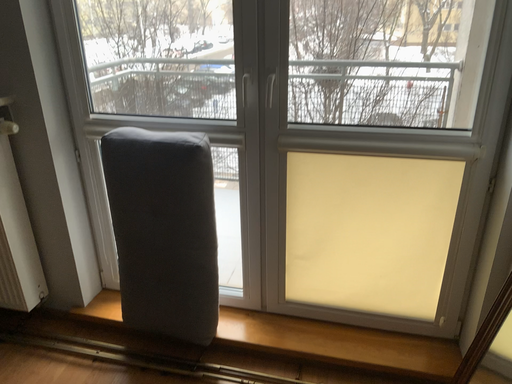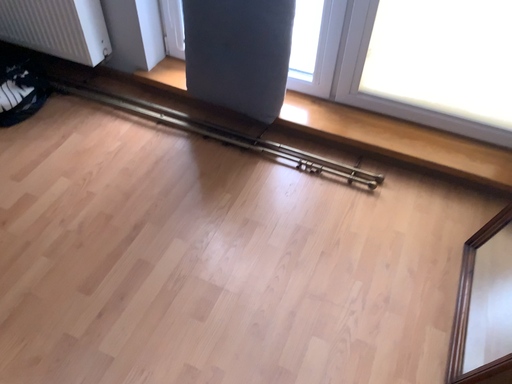
Question: How did the camera likely rotate when shooting the video?

Choices:
 (A) rotated left
 (B) rotated right

Answer: (A)